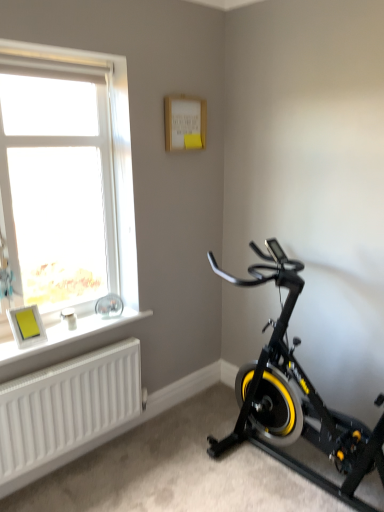
In order to face white matte window sill at lower left, should I rotate leftwards or rightwards?

To align with it, rotate left about 15.136°.

Locate an element on the screen. This screenshot has width=384, height=512. black matte stationary bicycle at lower right is located at coordinates (296, 397).

The height and width of the screenshot is (512, 384). What do you see at coordinates (26, 326) in the screenshot? I see `matte yellow picture frame at lower left` at bounding box center [26, 326].

The width and height of the screenshot is (384, 512). Describe the element at coordinates (66, 178) in the screenshot. I see `white plastic window at upper left` at that location.

Locate an element on the screen. This screenshot has height=512, width=384. white matte radiator at lower left is located at coordinates (66, 410).

From the picture: From the image's perspective, is white plastic window at upper left located above or below white matte window sill at lower left?

Based on their image positions, white plastic window at upper left is located above white matte window sill at lower left.

Considering the sizes of objects white plastic window at upper left and white matte window sill at lower left in the image provided, who is smaller, white plastic window at upper left or white matte window sill at lower left?

Smaller between the two is white matte window sill at lower left.

Which is more to the right, white plastic window at upper left or white matte window sill at lower left?

white matte window sill at lower left.

Would you consider white plastic window at upper left to be distant from white matte window sill at lower left?

No, white plastic window at upper left is not far from white matte window sill at lower left.

Which is closer, (242,411) or (106,390)?

Point (106,390)

Is black matte stationary bicycle at lower right far away from white matte radiator at lower left?

That's not correct — black matte stationary bicycle at lower right is a little close to white matte radiator at lower left.

From the image's perspective, is black matte stationary bicycle at lower right above or below white matte radiator at lower left?

black matte stationary bicycle at lower right is situated higher than white matte radiator at lower left in the image.

Between black matte stationary bicycle at lower right and white matte radiator at lower left, which one appears on the left side from the viewer's perspective?

Positioned to the left is white matte radiator at lower left.

The width and height of the screenshot is (384, 512). What are the coordinates of `window above the black matte stationary bicycle at lower right (from the image's perspective)` in the screenshot? It's located at (x=66, y=178).

Is white plastic window at upper left far away from black matte stationary bicycle at lower right?

white plastic window at upper left is positioned a significant distance from black matte stationary bicycle at lower right.

Between white plastic window at upper left and black matte stationary bicycle at lower right, which one has smaller width?

Thinner between the two is white plastic window at upper left.

Which of these two, white plastic window at upper left or black matte stationary bicycle at lower right, stands taller?

white plastic window at upper left is taller.

Would you say matte yellow picture frame at lower left is outside white matte window sill at lower left?

That's correct, matte yellow picture frame at lower left is outside of white matte window sill at lower left.

This screenshot has height=512, width=384. I want to click on window sill below the matte yellow picture frame at lower left (from the image's perspective), so click(69, 334).

Between matte yellow picture frame at lower left and white matte window sill at lower left, which one is positioned in front?

white matte window sill at lower left is closer to the camera.

Is matte yellow picture frame at lower left aimed at white matte window sill at lower left?

No.

Is white matte radiator at lower left positioned with its back to matte yellow picture frame at lower left?

No, matte yellow picture frame at lower left is not at the back of white matte radiator at lower left.

Considering the positions of objects white matte radiator at lower left and matte yellow picture frame at lower left in the image provided, who is in front, white matte radiator at lower left or matte yellow picture frame at lower left?

Positioned in front is white matte radiator at lower left.

Which of these two, white matte radiator at lower left or matte yellow picture frame at lower left, stands taller?

With more height is white matte radiator at lower left.

Would you consider white matte window sill at lower left to be distant from white matte radiator at lower left?

white matte window sill at lower left is actually quite close to white matte radiator at lower left.

Looking at the image, does white matte window sill at lower left seem bigger or smaller compared to white matte radiator at lower left?

Considering their sizes, white matte window sill at lower left takes up less space than white matte radiator at lower left.

Between white matte window sill at lower left and white matte radiator at lower left, which one appears on the right side from the viewer's perspective?

white matte radiator at lower left.

Which of these two, white matte window sill at lower left or white matte radiator at lower left, stands shorter?

white matte window sill at lower left.

Does matte yellow picture frame at lower left lie behind white plastic window at upper left?

Yes, it is.

Is matte yellow picture frame at lower left to the left or to the right of white plastic window at upper left in the image?

From the image, it's evident that matte yellow picture frame at lower left is to the left of white plastic window at upper left.

Which is less distant, (31,319) or (48,140)?

Point (31,319) is positioned closer to the camera compared to point (48,140).

Is there a large distance between matte yellow picture frame at lower left and white plastic window at upper left?

No, matte yellow picture frame at lower left is not far from white plastic window at upper left.

Where is `window sill that appears behind the white plastic window at upper left`? window sill that appears behind the white plastic window at upper left is located at coordinates (69, 334).

The image size is (384, 512). I want to click on stationary bicycle on the right of the white matte radiator at lower left, so click(296, 397).

Looking at the image, which one is located closer to matte yellow picture frame at lower left, white plastic window at upper left or white matte radiator at lower left?

Among the two, white matte radiator at lower left is located nearer to matte yellow picture frame at lower left.

Estimate the real-world distances between objects in this image. Which object is closer to black matte stationary bicycle at lower right, white matte radiator at lower left or matte yellow picture frame at lower left?

Among the two, white matte radiator at lower left is located nearer to black matte stationary bicycle at lower right.

Based on the photo, based on their spatial positions, is white matte window sill at lower left or white plastic window at upper left closer to matte yellow picture frame at lower left?

The object closer to matte yellow picture frame at lower left is white matte window sill at lower left.

Considering their positions, is black matte stationary bicycle at lower right positioned further to white plastic window at upper left than white matte radiator at lower left?

black matte stationary bicycle at lower right is positioned further to the anchor white plastic window at upper left.

When comparing their distances from white matte radiator at lower left, does matte yellow picture frame at lower left or white matte window sill at lower left seem further?

matte yellow picture frame at lower left.

When comparing their distances from white plastic window at upper left, does white matte window sill at lower left or black matte stationary bicycle at lower right seem further?

black matte stationary bicycle at lower right lies further to white plastic window at upper left than the other object.

Estimate the real-world distances between objects in this image. Which object is closer to white matte window sill at lower left, black matte stationary bicycle at lower right or white matte radiator at lower left?

The object closer to white matte window sill at lower left is white matte radiator at lower left.

Considering their positions, is black matte stationary bicycle at lower right positioned closer to white plastic window at upper left than white matte window sill at lower left?

white matte window sill at lower left lies closer to white plastic window at upper left than the other object.

Where is `radiator located between white matte window sill at lower left and black matte stationary bicycle at lower right in the left-right direction`? The image size is (384, 512). radiator located between white matte window sill at lower left and black matte stationary bicycle at lower right in the left-right direction is located at coordinates (66, 410).

At what (x,y) coordinates should I click in order to perform the action: click on window situated between matte yellow picture frame at lower left and black matte stationary bicycle at lower right from left to right. Please return your answer as a coordinate pair (x, y). Looking at the image, I should click on (66, 178).

At what (x,y) coordinates should I click in order to perform the action: click on window sill between matte yellow picture frame at lower left and white matte radiator at lower left vertically. Please return your answer as a coordinate pair (x, y). The image size is (384, 512). Looking at the image, I should click on (69, 334).

The image size is (384, 512). I want to click on radiator between matte yellow picture frame at lower left and black matte stationary bicycle at lower right in the horizontal direction, so click(66, 410).